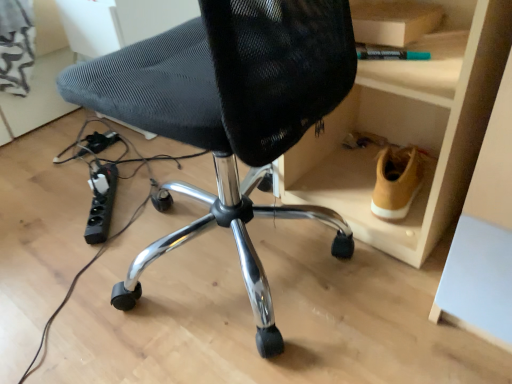
The width and height of the screenshot is (512, 384). I want to click on black plastic plug at lower left, which is the 2th plug in right-to-left order, so click(100, 141).

The width and height of the screenshot is (512, 384). Describe the element at coordinates (101, 203) in the screenshot. I see `black plastic power strip at lower left, the first plug viewed from the front` at that location.

Locate an element on the screen. This screenshot has height=384, width=512. black mesh chair at center is located at coordinates (230, 114).

Where is `tan suede shoe at lower right`? tan suede shoe at lower right is located at coordinates (397, 181).

What are the coordinates of `black plastic plug at lower left, acting as the 2th plug starting from the bottom` in the screenshot? It's located at (100, 141).

From a real-world perspective, which object rests below the other?

From a 3D spatial view, black plastic power strip at lower left, arranged as the first plug when ordered from the bottom, is below.

Is point (130, 275) positioned before point (105, 184)?

Yes, it is in front of point (105, 184).

Does black mesh chair at center lie in front of black plastic power strip at lower left, which ranks as the 2th plug in top-to-bottom order?

Yes, it is.

Could you tell me if black plastic plug at lower left, acting as the first plug starting from the top, is facing tan suede shoe at lower right?

No, black plastic plug at lower left, acting as the first plug starting from the top, is not turned towards tan suede shoe at lower right.

How many degrees apart are the facing directions of black plastic plug at lower left, acting as the 2th plug starting from the bottom, and tan suede shoe at lower right?

7.47 degrees separate the facing orientations of black plastic plug at lower left, acting as the 2th plug starting from the bottom, and tan suede shoe at lower right.

Is black plastic plug at lower left, acting as the first plug starting from the top, to the left or to the right of tan suede shoe at lower right in the image?

Clearly, black plastic plug at lower left, acting as the first plug starting from the top, is on the left of tan suede shoe at lower right in the image.

From the image's perspective, which is above, black plastic plug at lower left, placed as the first plug when sorted from left to right, or tan suede shoe at lower right?

black plastic plug at lower left, placed as the first plug when sorted from left to right.

Considering the sizes of objects black plastic power strip at lower left, acting as the first plug starting from the right, and tan suede shoe at lower right in the image provided, who is smaller, black plastic power strip at lower left, acting as the first plug starting from the right, or tan suede shoe at lower right?

With smaller size is black plastic power strip at lower left, acting as the first plug starting from the right.

Which is less distant, (115, 192) or (392, 215)?

Point (115, 192) appears to be farther away from the viewer than point (392, 215).

From a real-world perspective, is black plastic power strip at lower left, which is the second plug in back-to-front order, beneath tan suede shoe at lower right?

Yes, from a real-world perspective, black plastic power strip at lower left, which is the second plug in back-to-front order, is under tan suede shoe at lower right.

In terms of height, does black mesh chair at center look taller or shorter compared to tan suede shoe at lower right?

In the image, black mesh chair at center appears to be taller than tan suede shoe at lower right.

Is black mesh chair at center aimed at tan suede shoe at lower right?

No.

In terms of size, does black mesh chair at center appear bigger or smaller than tan suede shoe at lower right?

In the image, black mesh chair at center appears to be larger than tan suede shoe at lower right.

In the image, is black mesh chair at center positioned in front of or behind tan suede shoe at lower right?

Visually, black mesh chair at center is located in front of tan suede shoe at lower right.

Would you say black plastic power strip at lower left, which is the second plug in back-to-front order, is inside or outside black plastic plug at lower left, acting as the first plug starting from the top?

black plastic power strip at lower left, which is the second plug in back-to-front order, is outside black plastic plug at lower left, acting as the first plug starting from the top.

Consider the image. Is black plastic power strip at lower left, the first plug viewed from the front, positioned with its back to black plastic plug at lower left, acting as the 2th plug starting from the bottom?

Yes, black plastic power strip at lower left, the first plug viewed from the front, is facing away from black plastic plug at lower left, acting as the 2th plug starting from the bottom.

From a real-world perspective, is black plastic power strip at lower left, acting as the first plug starting from the right, positioned above or below black plastic plug at lower left, positioned as the second plug in front-to-back order?

Clearly, from a real-world perspective, black plastic power strip at lower left, acting as the first plug starting from the right, is above black plastic plug at lower left, positioned as the second plug in front-to-back order.

Can you confirm if black plastic power strip at lower left, which is the second plug in back-to-front order, is thinner than black plastic plug at lower left, placed as the first plug when sorted from back to front?

No.

Looking at this image, which of these two, tan suede shoe at lower right or black plastic power strip at lower left, the second plug when ordered from left to right, stands shorter?

Standing shorter between the two is black plastic power strip at lower left, the second plug when ordered from left to right.

How much distance is there between tan suede shoe at lower right and black plastic power strip at lower left, which is the second plug in back-to-front order?

They are 75.17 centimeters apart.

Would you say tan suede shoe at lower right is inside or outside black plastic power strip at lower left, which is the second plug in back-to-front order?

The correct answer is: outside.

From the image's perspective, who appears lower, tan suede shoe at lower right or black plastic power strip at lower left, arranged as the first plug when ordered from the bottom?

black plastic power strip at lower left, arranged as the first plug when ordered from the bottom.

In terms of height, does black plastic plug at lower left, which is the 2th plug in right-to-left order, look taller or shorter compared to black mesh chair at center?

Considering their sizes, black plastic plug at lower left, which is the 2th plug in right-to-left order, has less height than black mesh chair at center.

Considering the positions of objects black plastic plug at lower left, placed as the first plug when sorted from back to front, and black mesh chair at center in the image provided, who is more to the left, black plastic plug at lower left, placed as the first plug when sorted from back to front, or black mesh chair at center?

From the viewer's perspective, black plastic plug at lower left, placed as the first plug when sorted from back to front, appears more on the left side.

Is black mesh chair at center at the back of black plastic plug at lower left, placed as the first plug when sorted from left to right?

No, black plastic plug at lower left, placed as the first plug when sorted from left to right, is not facing away from black mesh chair at center.

This screenshot has height=384, width=512. I want to click on chair above the black plastic power strip at lower left, arranged as the first plug when ordered from the bottom (from a real-world perspective), so click(x=230, y=114).

This screenshot has width=512, height=384. I want to click on the 2nd plug behind the tan suede shoe at lower right, so click(x=100, y=141).

When comparing their distances from black mesh chair at center, does tan suede shoe at lower right or black plastic power strip at lower left, which is the second plug in back-to-front order, seem closer?

tan suede shoe at lower right.

When comparing their distances from black plastic plug at lower left, placed as the first plug when sorted from left to right, does black mesh chair at center or black plastic power strip at lower left, the first plug viewed from the front, seem further?

black mesh chair at center is positioned further to the anchor black plastic plug at lower left, placed as the first plug when sorted from left to right.

When comparing their distances from black plastic power strip at lower left, arranged as the first plug when ordered from the bottom, does black plastic plug at lower left, placed as the first plug when sorted from left to right, or tan suede shoe at lower right seem closer?

black plastic plug at lower left, placed as the first plug when sorted from left to right, is closer to black plastic power strip at lower left, arranged as the first plug when ordered from the bottom.

Consider the image. Looking at the image, which one is located closer to black plastic power strip at lower left, arranged as the first plug when ordered from the bottom, tan suede shoe at lower right or black plastic plug at lower left, placed as the first plug when sorted from left to right?

black plastic plug at lower left, placed as the first plug when sorted from left to right.

From the image, which object appears to be farther from black mesh chair at center, black plastic plug at lower left, which is the 2th plug in right-to-left order, or black plastic power strip at lower left, the first plug viewed from the front?

black plastic plug at lower left, which is the 2th plug in right-to-left order, is positioned further to the anchor black mesh chair at center.

Estimate the real-world distances between objects in this image. Which object is closer to tan suede shoe at lower right, black mesh chair at center or black plastic power strip at lower left, the second plug when ordered from left to right?

Based on the image, black mesh chair at center appears to be nearer to tan suede shoe at lower right.

Looking at the image, which one is located further to black mesh chair at center, black plastic plug at lower left, acting as the first plug starting from the top, or tan suede shoe at lower right?

Based on the image, black plastic plug at lower left, acting as the first plug starting from the top, appears to be further to black mesh chair at center.

Considering their positions, is black mesh chair at center positioned closer to tan suede shoe at lower right than black plastic plug at lower left, placed as the first plug when sorted from back to front?

black mesh chair at center lies closer to tan suede shoe at lower right than the other object.

Locate an element on the screen. This screenshot has height=384, width=512. chair between black plastic power strip at lower left, which is the second plug in back-to-front order, and tan suede shoe at lower right from left to right is located at coordinates (230, 114).

Image resolution: width=512 pixels, height=384 pixels. I want to click on plug between black plastic plug at lower left, acting as the first plug starting from the top, and tan suede shoe at lower right from left to right, so [x=101, y=203].

Identify the location of footwear between black mesh chair at center and black plastic plug at lower left, acting as the first plug starting from the top, in the front-back direction. This screenshot has width=512, height=384. click(x=397, y=181).

This screenshot has height=384, width=512. In order to click on plug between black mesh chair at center and black plastic plug at lower left, placed as the first plug when sorted from back to front, along the z-axis in this screenshot , I will do `click(101, 203)`.